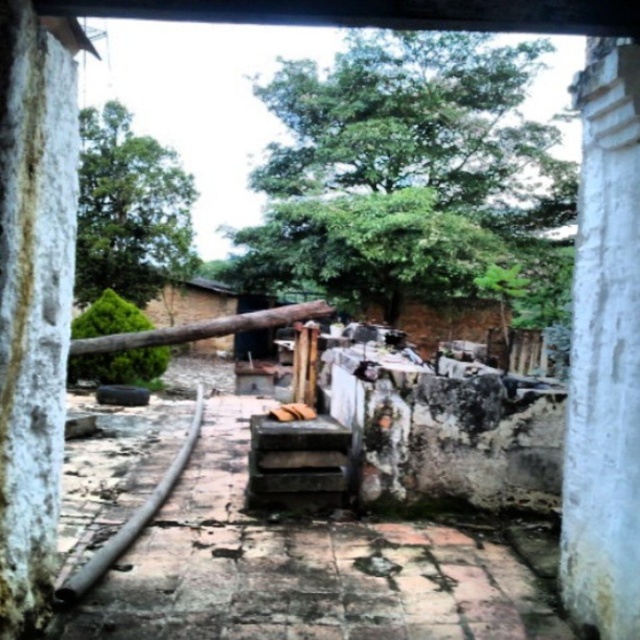
Which is below, concrete block at center or white rough stone pillar at center?

concrete block at center

Does concrete block at center appear on the right side of white rough stone pillar at center?

No, concrete block at center is not to the right of white rough stone pillar at center.

Is point (292, 529) more distant than point (616, 637)?

Yes, it is.

Where is `concrete block at center`? The height and width of the screenshot is (640, 640). concrete block at center is located at coordinates (305, 566).

Which is more to the right, white rough stone pillar at left or white rough stone pillar at center?

From the viewer's perspective, white rough stone pillar at center appears more on the right side.

Is white rough stone pillar at left wider than white rough stone pillar at center?

No.

Where is `white rough stone pillar at left`? This screenshot has height=640, width=640. white rough stone pillar at left is located at coordinates (33, 300).

Identify the location of white rough stone pillar at left. (33, 300).

Where is `concrete block at center`? The width and height of the screenshot is (640, 640). concrete block at center is located at coordinates (305, 566).

Can you confirm if concrete block at center is thinner than white rough stone pillar at left?

No.

Locate an element on the screen. concrete block at center is located at coordinates (305, 566).